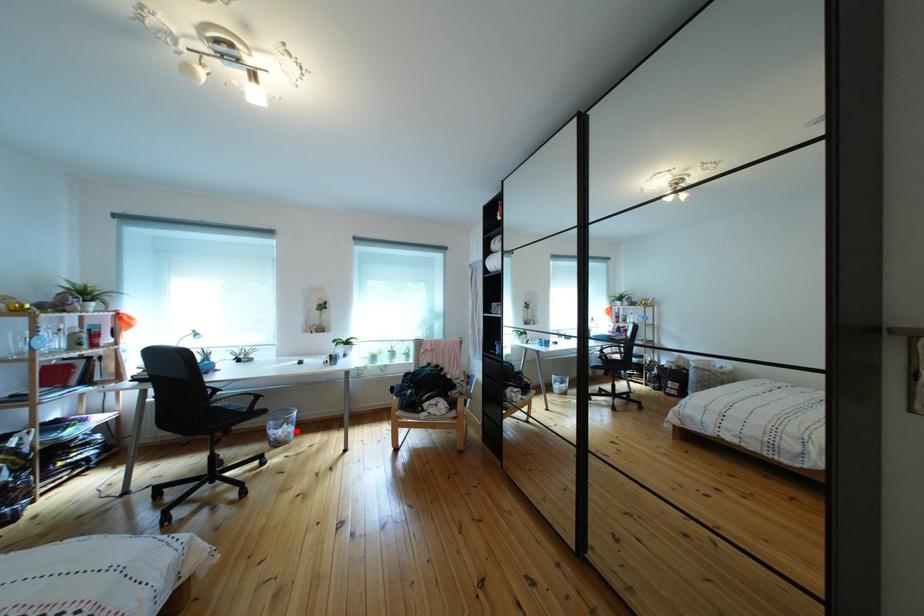
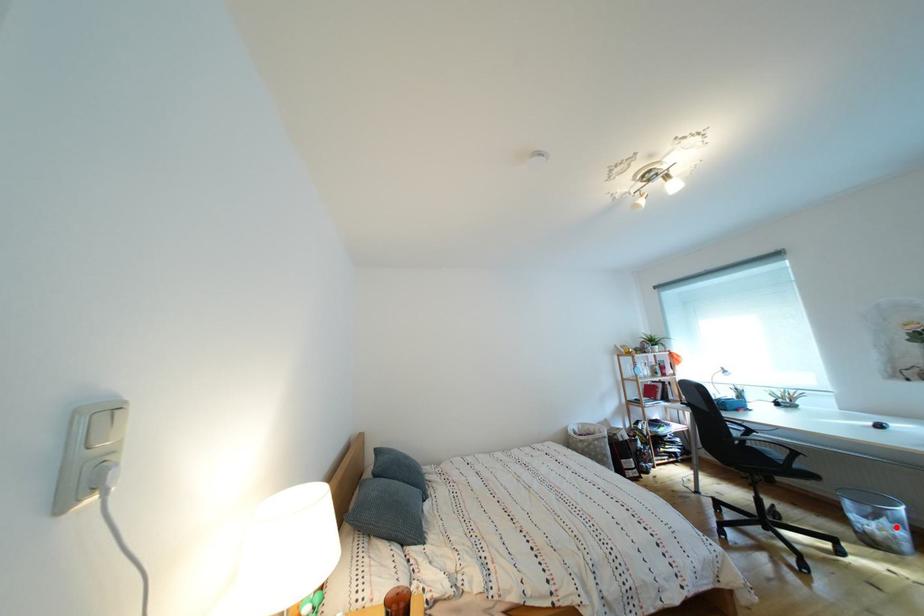
I am providing you with two images of the same scene from different viewpoints. A red point is marked on the first image and another point is marked on the second image. Is the marked point in image1 the same physical position as the marked point in image2?

Yes